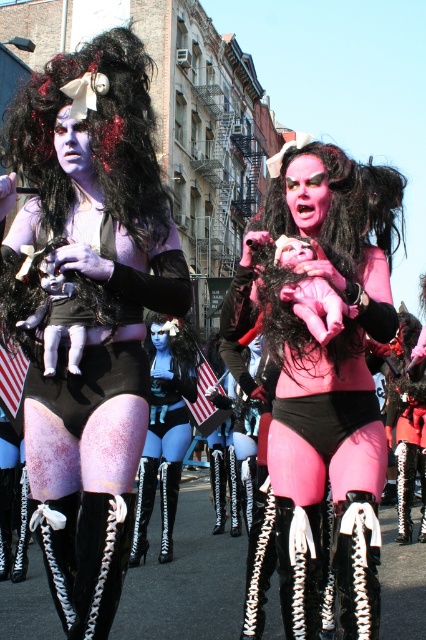
You are a photographer trying to capture the perfect shot of the matte black wig at center. Based on its position at coordinates point 0.669, 0.387, where should you aim your camera to ensure it is centered in the frame?

The matte black wig at center is already positioned at point (x=164, y=428), so aiming your camera directly at that coordinate will center it in the frame.

You are a photographer standing between the two performers and want to take a photo of the matte black doll at center. Which performer should you focus on to capture the doll in the frame?

The matte black doll at center belongs to the performer on the left, so you should focus on the performer on the left to capture the doll in the frame.

You are a photographer trying to capture a photo of the purple matte wig at upper left without the matte black doll at center blocking the view. Is this possible given their positions?

The matte black doll at center is in front of the purple matte wig at upper left, so it will block the view. To capture the purple matte wig at upper left without obstruction, you need to move around the matte black doll at center to a position where the doll is no longer between you and the wig.